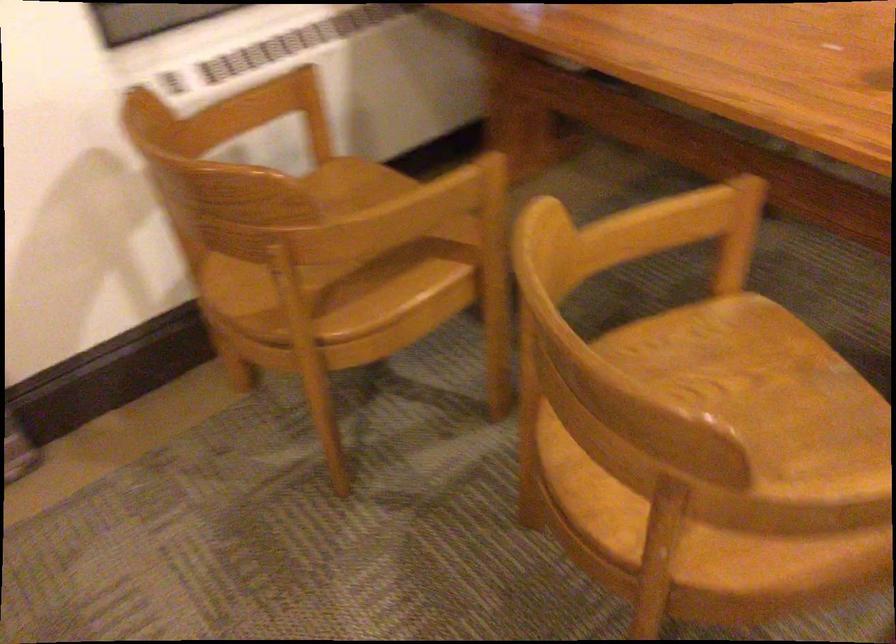
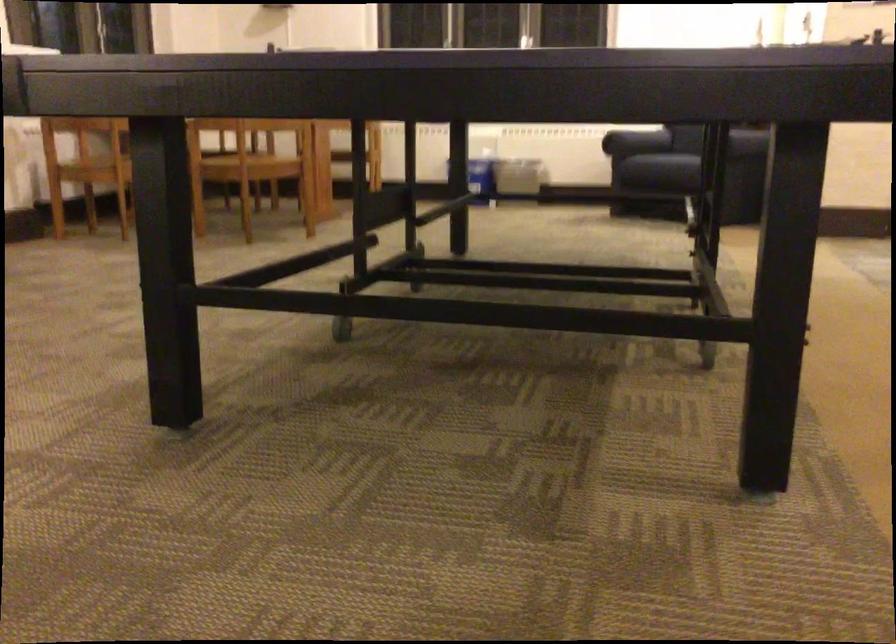
Where in the second image is the point corresponding to (x=236, y=312) from the first image?

(95, 169)